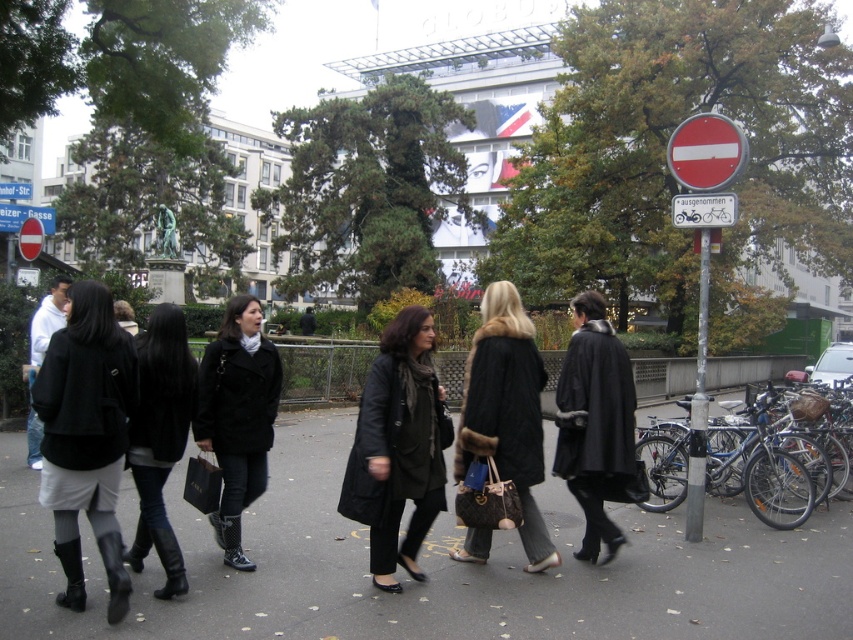
Does red matte sign at upper right have a lesser height compared to red plastic sign at upper left?

Yes.

Locate an element on the screen. red matte sign at upper right is located at coordinates (706, 150).

Does matte black coat at center have a smaller size compared to red matte sign at upper right?

No.

At what (x,y) coordinates should I click in order to perform the action: click on matte black coat at center. Please return your answer as a coordinate pair (x, y). This screenshot has height=640, width=853. Looking at the image, I should click on (398, 448).

Identify the location of matte black coat at center. This screenshot has height=640, width=853. (398, 448).

Is black asphalt at center smaller than black fur-trimmed coat at center?

Yes.

Is black asphalt at center wider than black fur-trimmed coat at center?

Indeed, black asphalt at center has a greater width compared to black fur-trimmed coat at center.

Where is `black asphalt at center`? black asphalt at center is located at coordinates (434, 566).